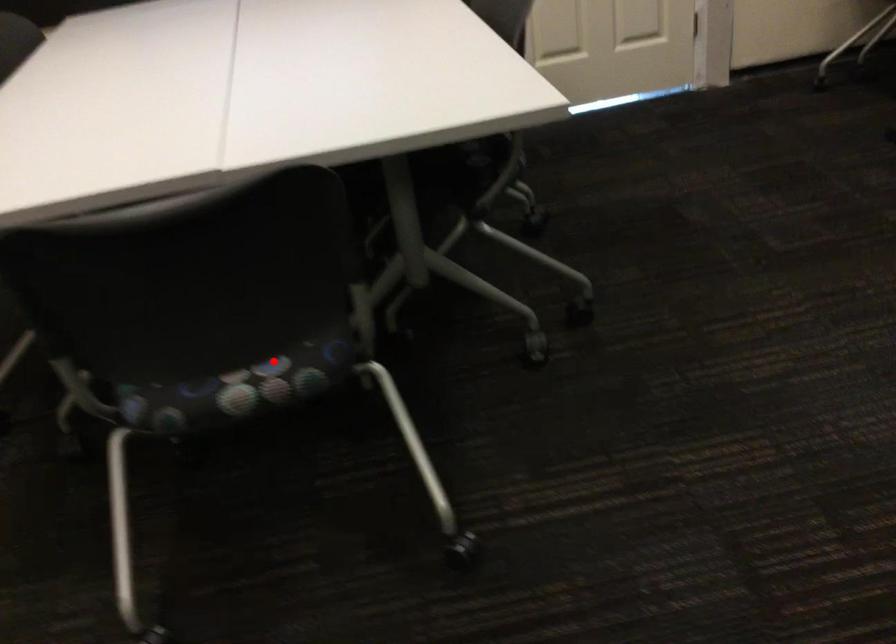
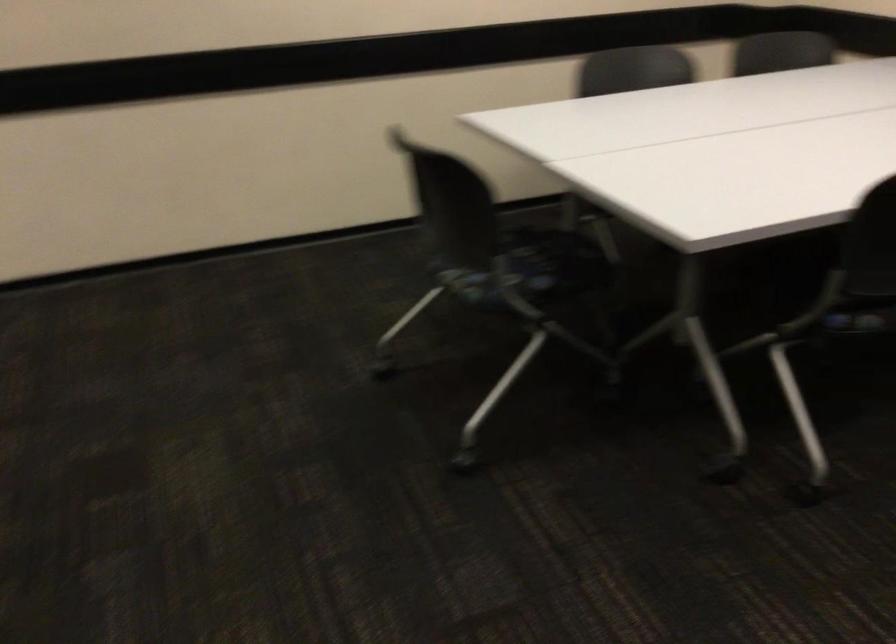
Question: I am providing you with two images of the same scene from different viewpoints. In image1, a red point is highlighted. Considering the same 3D point in image2, which of the following is correct?

Choices:
 (A) It is closer
 (B) It is farther

Answer: (B)